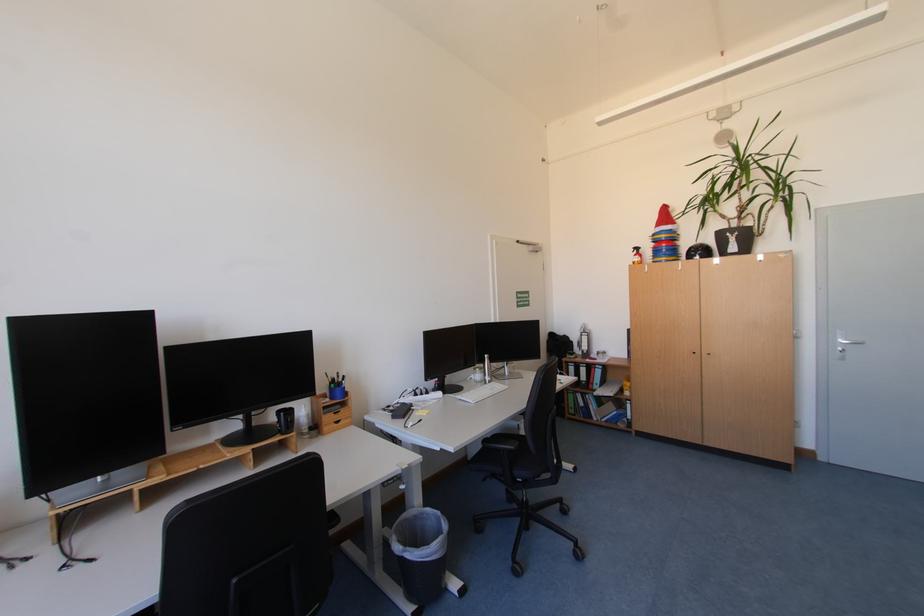
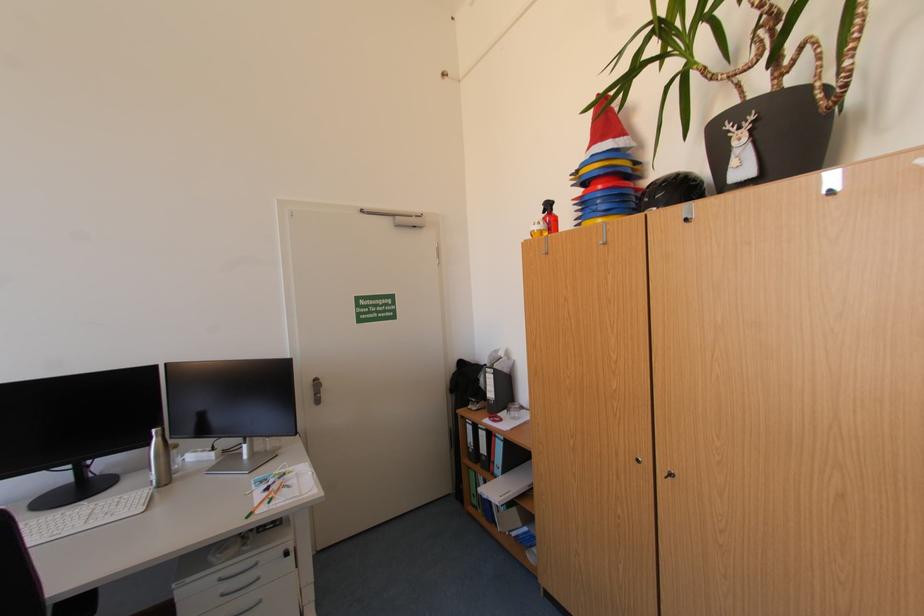
Locate, in the second image, the point that corresponds to pixel 672 252 in the first image.

(606, 203)